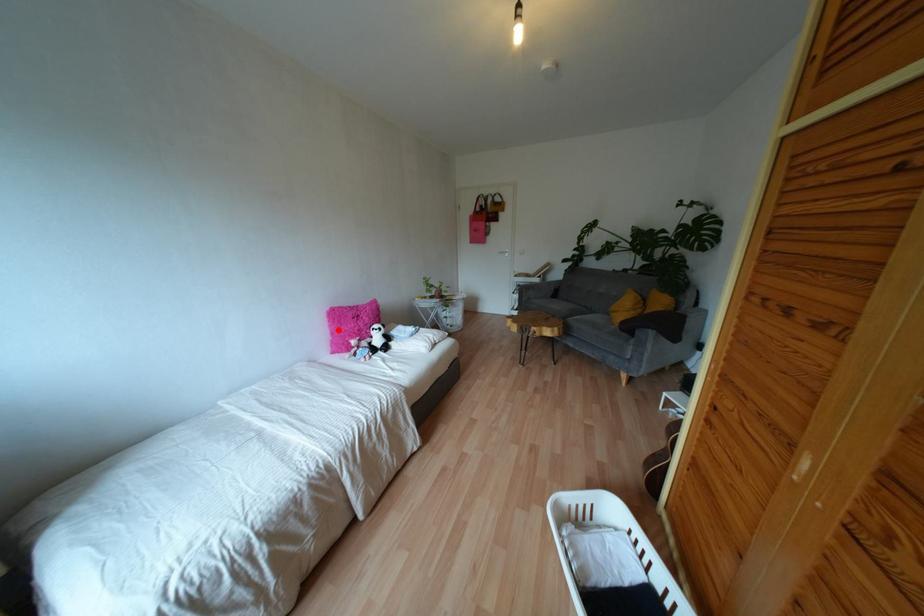
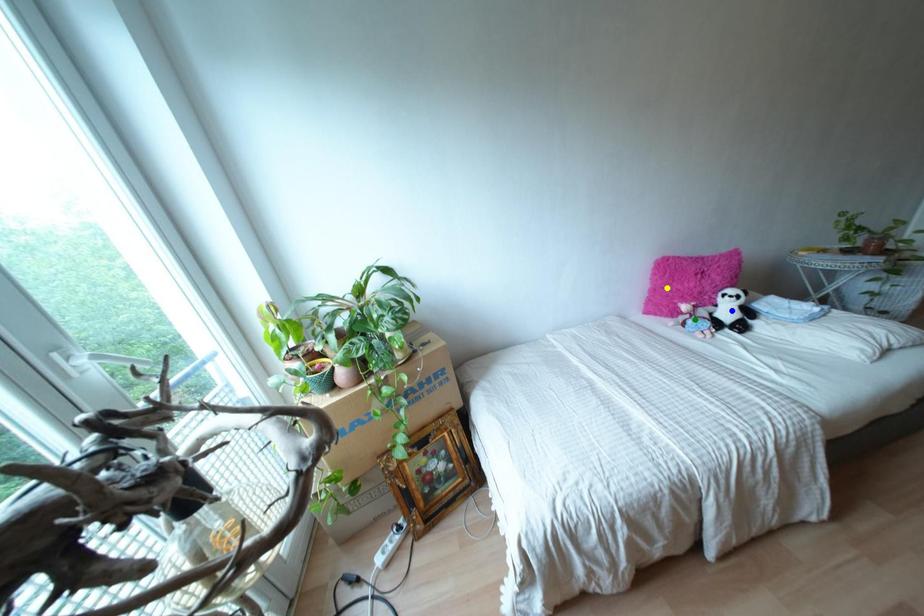
Question: I am providing you with two images of the same scene from different viewpoints. A red point is marked on the first image. You are given multiple points on the second image. In image 2, which mark is for the same physical point as the one in image 1?

Choices:
 (A) blue point
 (B) yellow point
 (C) green point

Answer: (B)